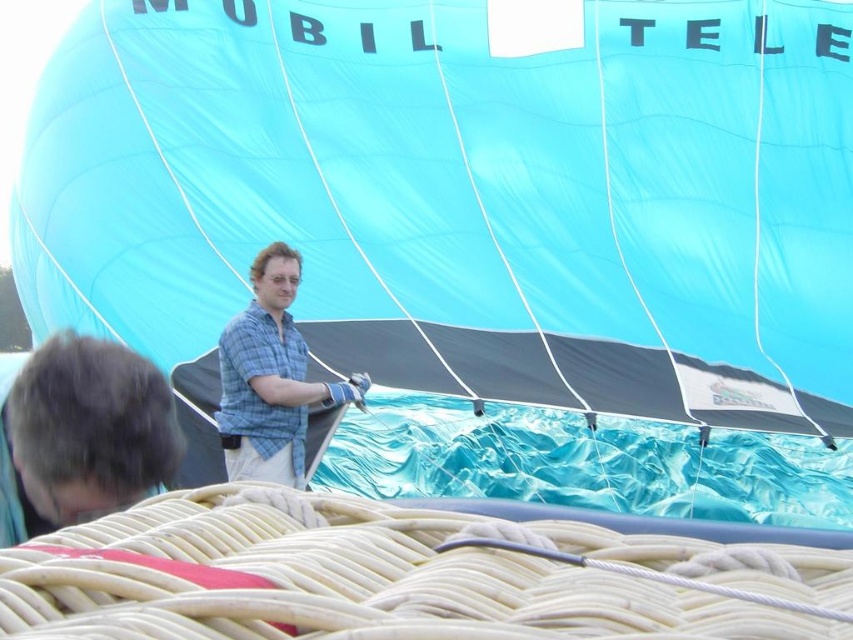
Can you confirm if blue glossy balloon at center is positioned below dark blue plaid shirt at center?

No.

Who is lower down, blue glossy balloon at center or dark blue plaid shirt at center?

dark blue plaid shirt at center is below.

Does point (326, 145) come closer to viewer compared to point (148, 452)?

No, it is not.

The image size is (853, 640). In order to click on blue glossy balloon at center in this screenshot , I will do `click(466, 195)`.

Is blue glossy balloon at center bigger than checkered fabric shirt at center?

Correct, blue glossy balloon at center is larger in size than checkered fabric shirt at center.

What do you see at coordinates (466, 195) in the screenshot?
I see `blue glossy balloon at center` at bounding box center [466, 195].

Find the location of a particular element. blue glossy balloon at center is located at coordinates (466, 195).

Between dark blue plaid shirt at center and checkered fabric shirt at center, which one is positioned higher?

dark blue plaid shirt at center is above.

Find the location of a particular element. Image resolution: width=853 pixels, height=640 pixels. dark blue plaid shirt at center is located at coordinates (80, 433).